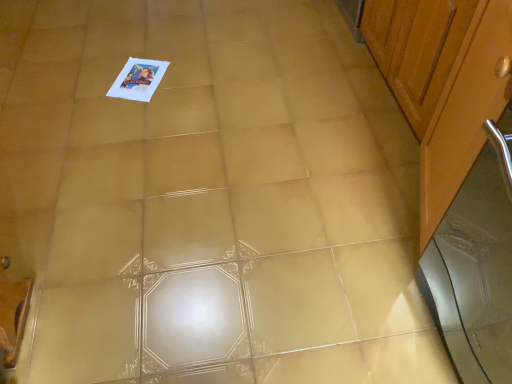
Looking at this image, in order to face silver metallic screen door at right, should I rotate leftwards or rightwards?

Rotate your view right by about 35.072°.

You are a GUI agent. You are given a task and a screenshot of the screen. Output one action in this format:
    pyautogui.click(x=<x>, y=<y>)
    Task: Click on the silver metallic screen door at right
    Image resolution: width=512 pixels, height=384 pixels.
    Given the screenshot: What is the action you would take?
    pyautogui.click(x=476, y=265)

Locate an element on the screen. silver metallic screen door at right is located at coordinates (476, 265).

Could you tell me if silver metallic screen door at right is turned towards wooden cabinet at right, which is the second cabinetry in front-to-back order?

No, silver metallic screen door at right is not turned towards wooden cabinet at right, which is the second cabinetry in front-to-back order.

Image resolution: width=512 pixels, height=384 pixels. What are the coordinates of `screen door above the wooden cabinet at right, the 1th cabinetry viewed from the back (from a real-world perspective)` in the screenshot? It's located at (476, 265).

From a real-world perspective, which is physically below, silver metallic screen door at right or wooden cabinet at right, the 1th cabinetry viewed from the back?

From a 3D spatial view, wooden cabinet at right, the 1th cabinetry viewed from the back, is below.

Consider the image. Does silver metallic screen door at right appear on the left side of wooden cabinet at right, which is the second cabinetry in front-to-back order?

Correct, you'll find silver metallic screen door at right to the left of wooden cabinet at right, which is the second cabinetry in front-to-back order.

Is point (464, 312) positioned in front of point (470, 62)?

No, it is not.

How distant is silver metallic screen door at right from wooden cabinet at right, the second cabinetry when ordered from back to front?

The distance of silver metallic screen door at right from wooden cabinet at right, the second cabinetry when ordered from back to front, is 13.13 inches.

Based on the photo, from a real-world perspective, which object rests below the other?

From a 3D spatial view, silver metallic screen door at right is below.

From the image's perspective, between wooden cabinet at right, placed as the 1th cabinetry when sorted from front to back, and silver metallic screen door at right, which one is located above?

wooden cabinet at right, placed as the 1th cabinetry when sorted from front to back, is shown above in the image.

Is the surface of wooden cabinet at right, the second cabinetry when ordered from back to front, in direct contact with silver metallic screen door at right?

There is a gap between wooden cabinet at right, the second cabinetry when ordered from back to front, and silver metallic screen door at right.

Is wooden cabinet at right, placed as the 1th cabinetry when sorted from front to back, oriented towards silver metallic screen door at right?

No, wooden cabinet at right, placed as the 1th cabinetry when sorted from front to back, is not oriented towards silver metallic screen door at right.

Is silver metallic screen door at right surrounded by wooden cabinet at right, the second cabinetry when ordered from back to front?

Actually, silver metallic screen door at right is outside wooden cabinet at right, the second cabinetry when ordered from back to front.

Is point (441, 38) positioned in front of point (444, 24)?

No, (441, 38) is behind (444, 24).

Is there a large distance between wooden cabinet at right, placed as the 1th cabinetry when sorted from front to back, and wooden cabinet at right, the 1th cabinetry viewed from the back?

No, there isn't a large distance between wooden cabinet at right, placed as the 1th cabinetry when sorted from front to back, and wooden cabinet at right, the 1th cabinetry viewed from the back.

Does wooden cabinet at right, placed as the 1th cabinetry when sorted from front to back, come behind wooden cabinet at right, which is the second cabinetry in front-to-back order?

No, wooden cabinet at right, placed as the 1th cabinetry when sorted from front to back, is closer to the viewer.

Is wooden cabinet at right, the 1th cabinetry viewed from the back, spatially inside silver metallic screen door at right, or outside of it?

The correct answer is: outside.

From the image's perspective, is wooden cabinet at right, which is the second cabinetry in front-to-back order, beneath silver metallic screen door at right?

No, from the image's perspective, wooden cabinet at right, which is the second cabinetry in front-to-back order, is not beneath silver metallic screen door at right.

Between wooden cabinet at right, the 1th cabinetry viewed from the back, and silver metallic screen door at right, which one has more height?

silver metallic screen door at right is taller.

You are a GUI agent. You are given a task and a screenshot of the screen. Output one action in this format:
    pyautogui.click(x=<x>, y=<y>)
    Task: Click on the screen door that is in front of the wooden cabinet at right, which is the second cabinetry in front-to-back order
    
    Given the screenshot: What is the action you would take?
    pyautogui.click(x=476, y=265)

Is wooden cabinet at right, which is the second cabinetry in front-to-back order, shorter than wooden cabinet at right, placed as the 1th cabinetry when sorted from front to back?

Yes.

Which point is more distant from viewer, [425,49] or [459,162]?

The point [425,49] is farther.

Is wooden cabinet at right, the 1th cabinetry viewed from the back, behind wooden cabinet at right, the second cabinetry when ordered from back to front?

Yes, wooden cabinet at right, the 1th cabinetry viewed from the back, is further from the camera.

Where is `the 2nd cabinetry behind the silver metallic screen door at right`? This screenshot has width=512, height=384. the 2nd cabinetry behind the silver metallic screen door at right is located at coordinates (416, 49).

Identify the location of screen door below the wooden cabinet at right, placed as the 1th cabinetry when sorted from front to back (from the image's perspective). (476, 265).

Estimate the real-world distances between objects in this image. Which object is further from silver metallic screen door at right, wooden cabinet at right, placed as the 1th cabinetry when sorted from front to back, or wooden cabinet at right, which is the second cabinetry in front-to-back order?

wooden cabinet at right, which is the second cabinetry in front-to-back order, is positioned further to the anchor silver metallic screen door at right.

When comparing their distances from wooden cabinet at right, which is the second cabinetry in front-to-back order, does wooden cabinet at right, the second cabinetry when ordered from back to front, or silver metallic screen door at right seem closer?

wooden cabinet at right, the second cabinetry when ordered from back to front, is positioned closer to the anchor wooden cabinet at right, which is the second cabinetry in front-to-back order.

Estimate the real-world distances between objects in this image. Which object is further from silver metallic screen door at right, wooden cabinet at right, which is the second cabinetry in front-to-back order, or wooden cabinet at right, the second cabinetry when ordered from back to front?

wooden cabinet at right, which is the second cabinetry in front-to-back order, is further to silver metallic screen door at right.

Which object lies nearer to the anchor point wooden cabinet at right, the second cabinetry when ordered from back to front, silver metallic screen door at right or wooden cabinet at right, which is the second cabinetry in front-to-back order?

Among the two, wooden cabinet at right, which is the second cabinetry in front-to-back order, is located nearer to wooden cabinet at right, the second cabinetry when ordered from back to front.

In the scene shown: From the image, which object appears to be nearer to wooden cabinet at right, the second cabinetry when ordered from back to front, wooden cabinet at right, the 1th cabinetry viewed from the back, or silver metallic screen door at right?

wooden cabinet at right, the 1th cabinetry viewed from the back, is closer to wooden cabinet at right, the second cabinetry when ordered from back to front.

Estimate the real-world distances between objects in this image. Which object is further from wooden cabinet at right, which is the second cabinetry in front-to-back order, silver metallic screen door at right or wooden cabinet at right, the second cabinetry when ordered from back to front?

silver metallic screen door at right lies further to wooden cabinet at right, which is the second cabinetry in front-to-back order, than the other object.

Find the location of a particular element. Image resolution: width=512 pixels, height=384 pixels. cabinetry between wooden cabinet at right, which is the second cabinetry in front-to-back order, and silver metallic screen door at right from top to bottom is located at coordinates (445, 84).